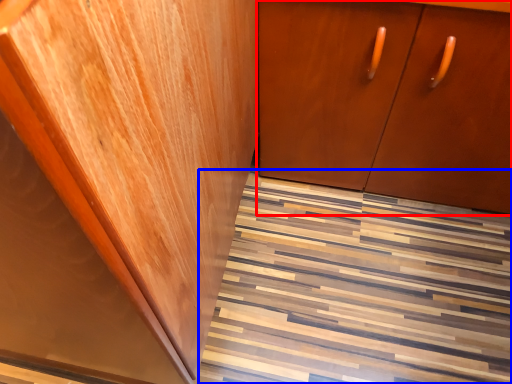
Question: Which of the following is the farthest to the observer, cabinetry (highlighted by a red box) or stairwell (highlighted by a blue box)?

Choices:
 (A) cabinetry
 (B) stairwell

Answer: (B)